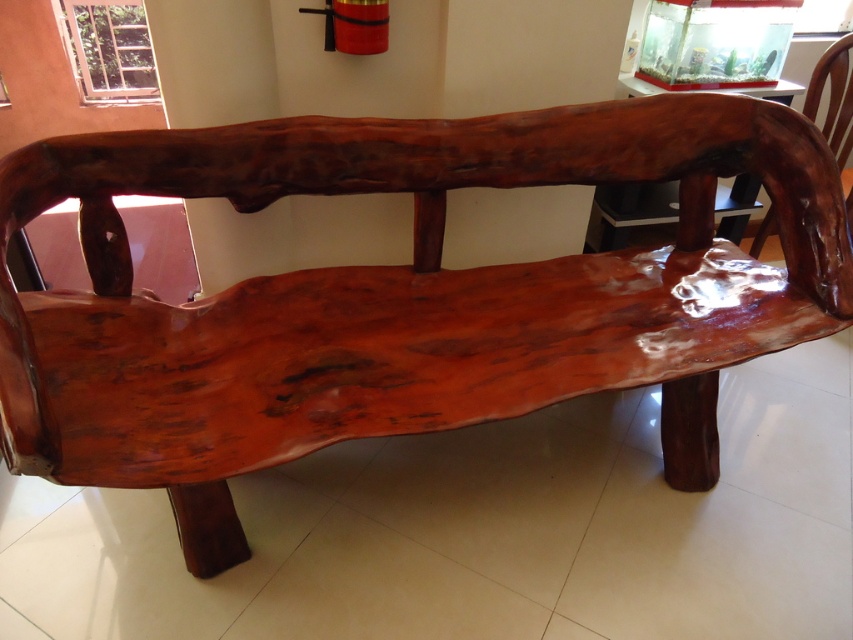
You are standing at the camera position and want to place a 5.5 feet long object on the floor between you and the glossy wood table at upper center. Will the object fit without overlapping the table?

The distance between the camera and the glossy wood table at upper center is 5.87 feet. Since the object is 5.5 feet long, it will fit without overlapping the table as there is enough space.

In the scene shown: You are a delivery person who needs to place a rectangular box measuring 50 centimeters in length between the glossy wood table at upper center and the glossy wood chair at upper right. Based on the available space, can the box fit between them without tilting it?

The distance between the glossy wood table at upper center and the glossy wood chair at upper right is 43.21 centimeters. Since the box is 50 centimeters long, it cannot fit straight between them without tilting.

You are arranging a small dining area and need to place the glossy wood table at upper center and the glossy wood chair at upper right. Which object has a greater width?

The glossy wood table at upper center has a greater width than the glossy wood chair at upper right according to the description.